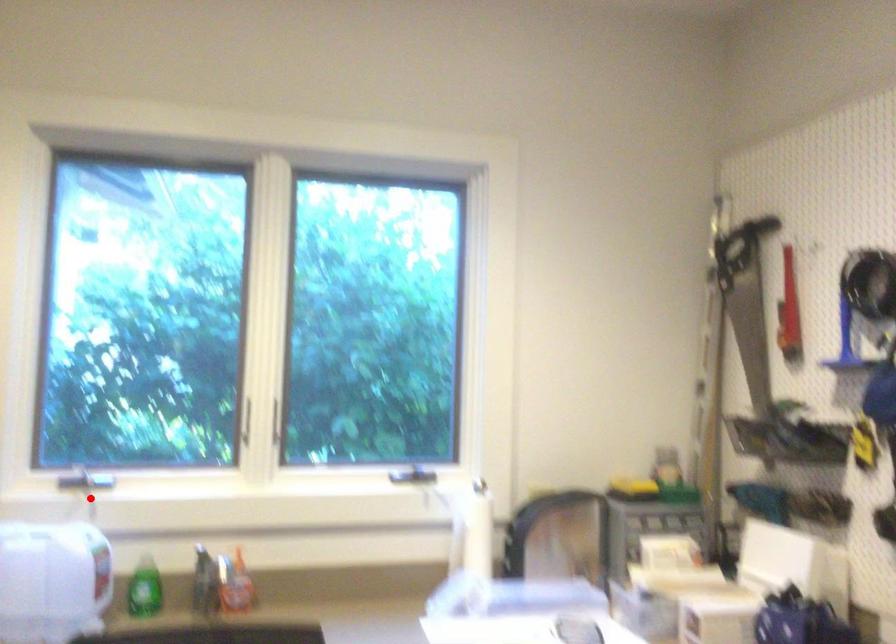
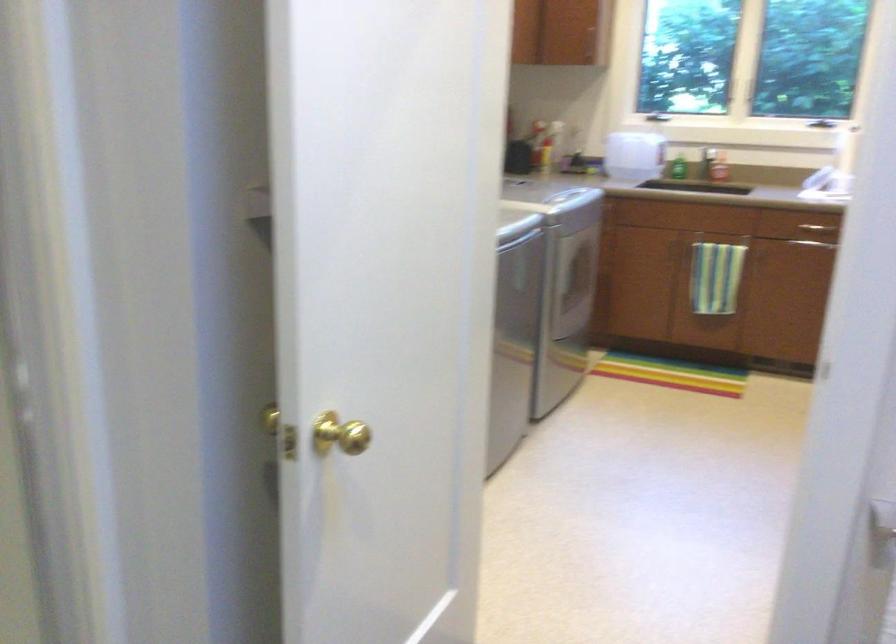
Locate, in the second image, the point that corresponds to the highlighted location in the first image.

(655, 116)